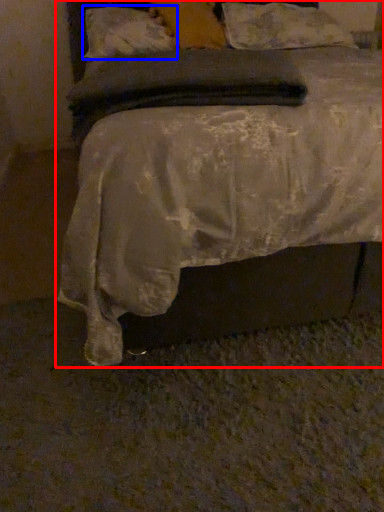
Question: Which point is closer to the camera, bed (highlighted by a red box) or pillow (highlighted by a blue box)?

Choices:
 (A) bed
 (B) pillow

Answer: (A)